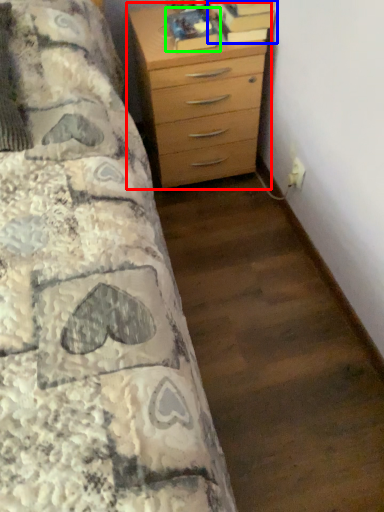
Question: Which object is positioned farthest from chest of drawers (highlighted by a red box)? Select from book (highlighted by a blue box) and book (highlighted by a green box).

Choices:
 (A) book
 (B) book

Answer: (A)